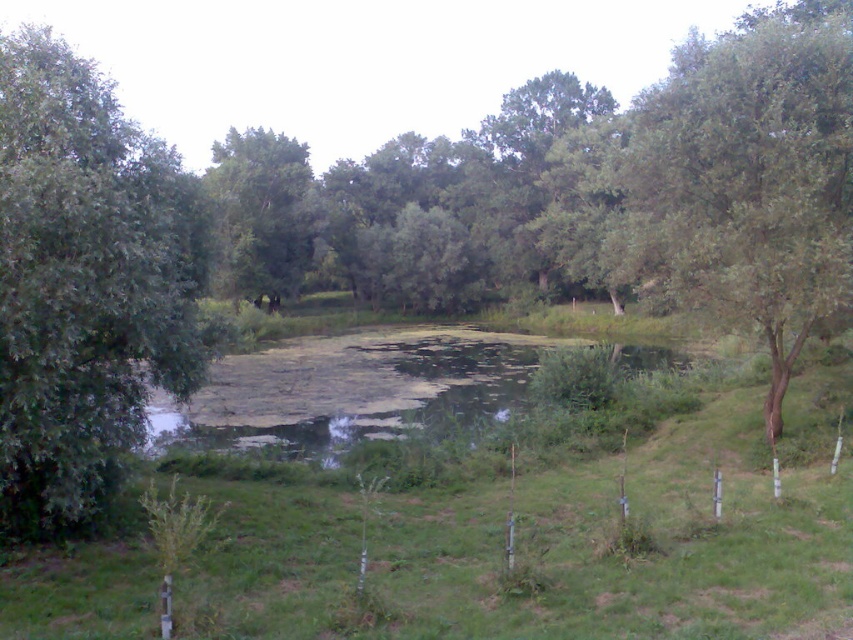
Locate an element on the screen. green leafy tree at left is located at coordinates (85, 284).

Who is higher up, green leafy tree at left or green leafy tree at center?

Positioned higher is green leafy tree at center.

Does point (102, 202) come farther from viewer compared to point (260, 128)?

That is False.

Where is `green leafy tree at left`? The height and width of the screenshot is (640, 853). green leafy tree at left is located at coordinates (85, 284).